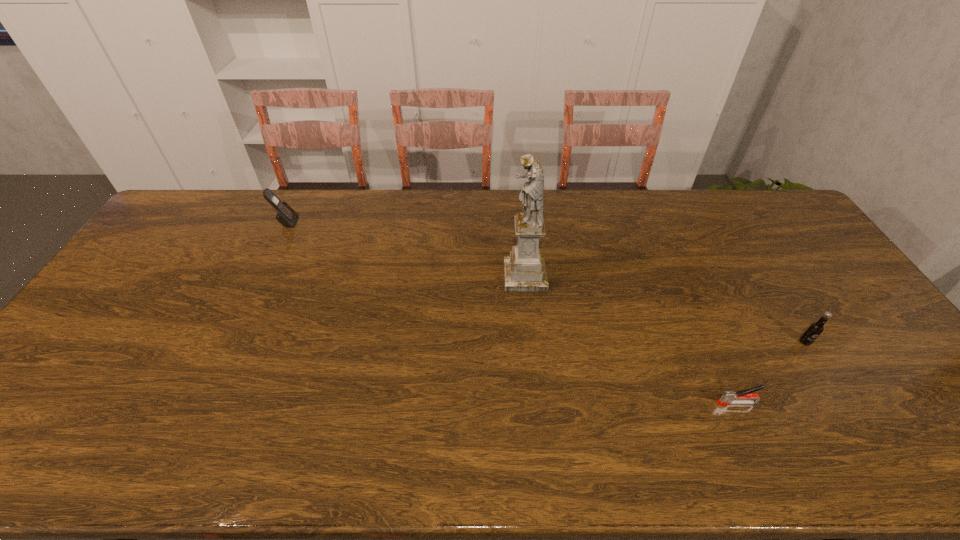
Where is `the third nearest object`? Image resolution: width=960 pixels, height=540 pixels. the third nearest object is located at coordinates (524, 270).

Where is `the third object from right to left`? the third object from right to left is located at coordinates (524, 270).

Find the location of a particular element. the leftmost object is located at coordinates (286, 216).

Identify the location of the farthest object. The image size is (960, 540). (286, 216).

Where is `root beer`? Image resolution: width=960 pixels, height=540 pixels. root beer is located at coordinates (815, 329).

Identify the location of the second nearest object. (815, 329).

The height and width of the screenshot is (540, 960). Find the location of `the shortest object`. the shortest object is located at coordinates (728, 397).

This screenshot has width=960, height=540. I want to click on the nearest object, so click(x=728, y=397).

This screenshot has height=540, width=960. I want to click on free space located 0.320m on the front-facing side of the third object from right to left, so click(400, 276).

Locate an element on the screen. This screenshot has height=540, width=960. vacant area situated on the front-facing side of the third object from right to left is located at coordinates (471, 276).